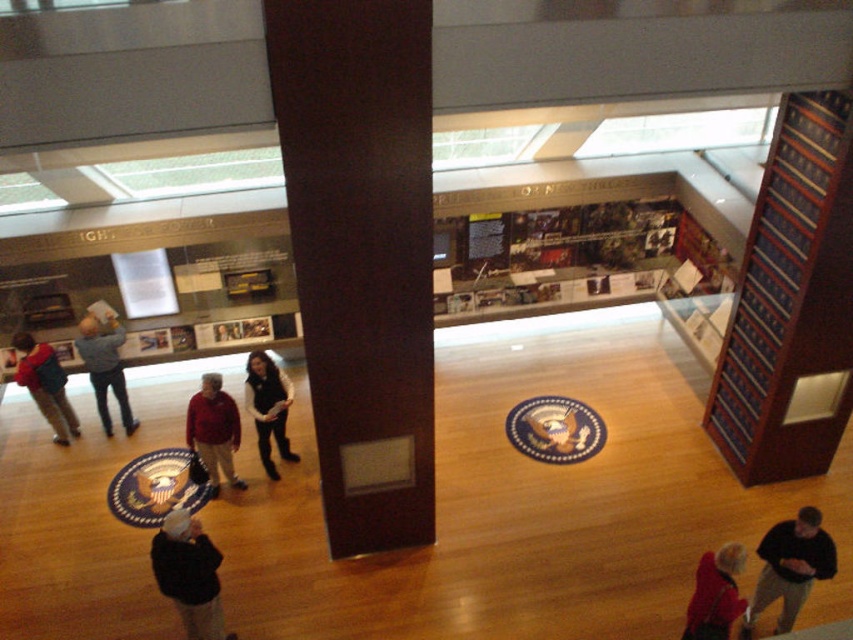
Between dark gray sweater at lower left and matte black backpack at left, which one has more height?

Standing taller between the two is dark gray sweater at lower left.

Is point (160, 547) positioned before point (62, 374)?

That is True.

Describe the element at coordinates (189, 573) in the screenshot. I see `dark gray sweater at lower left` at that location.

Find the location of `dark gray sweater at lower left`. dark gray sweater at lower left is located at coordinates (189, 573).

Can you confirm if dark brown wood pillar at center is thinner than red fleece jacket at center?

In fact, dark brown wood pillar at center might be wider than red fleece jacket at center.

Is the position of dark brown wood pillar at center more distant than that of red fleece jacket at center?

No, it is in front of red fleece jacket at center.

The width and height of the screenshot is (853, 640). What do you see at coordinates (361, 253) in the screenshot? I see `dark brown wood pillar at center` at bounding box center [361, 253].

The image size is (853, 640). I want to click on dark brown wood pillar at center, so tap(361, 253).

Who is higher up, dark gray sweater at lower left or gray sweater at left?

Positioned higher is gray sweater at left.

Does point (199, 593) come behind point (96, 364)?

No, it is in front of (96, 364).

You are a GUI agent. You are given a task and a screenshot of the screen. Output one action in this format:
    pyautogui.click(x=<x>, y=<y>)
    Task: Click on the dark gray sweater at lower left
    
    Given the screenshot: What is the action you would take?
    pyautogui.click(x=189, y=573)